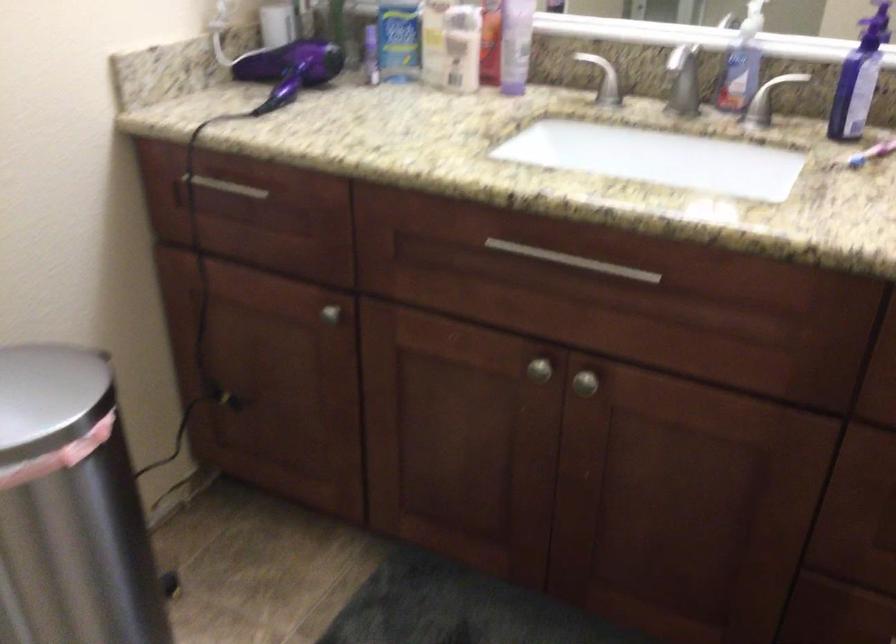
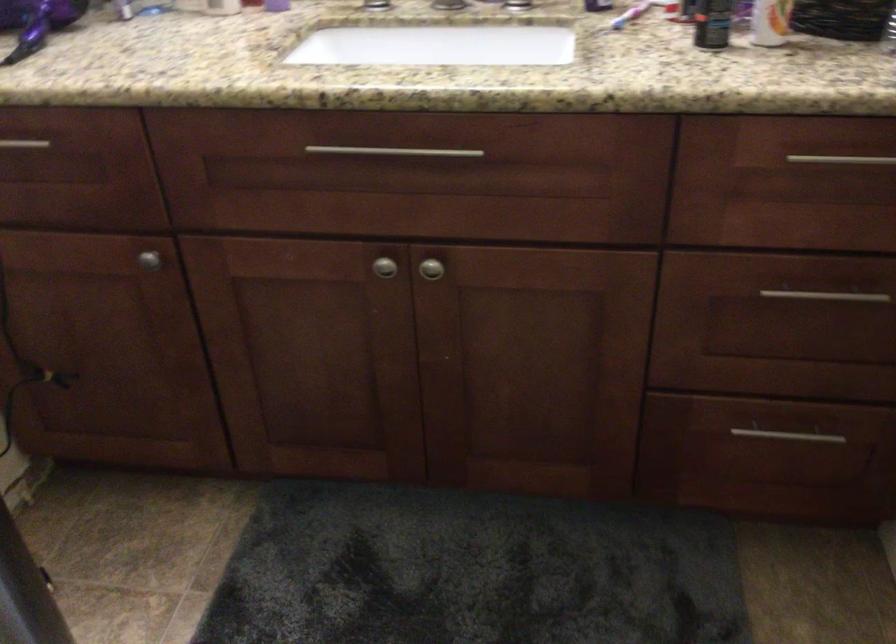
Find the pixel in the second image that matches point (540, 368) in the first image.

(383, 267)